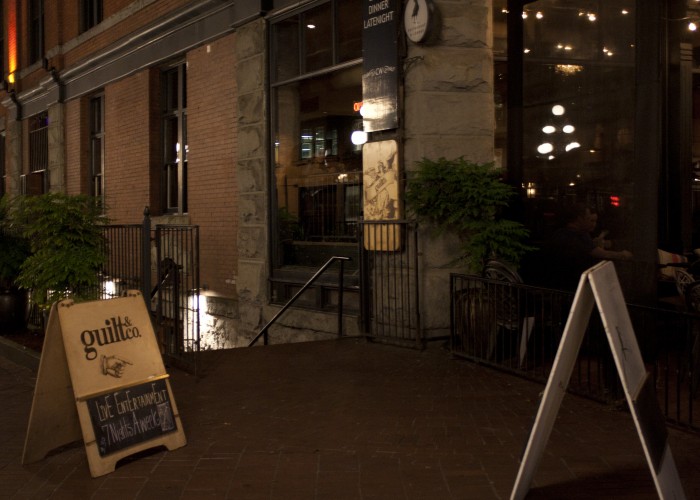
Where is `window`? window is located at coordinates (302, 167), (183, 161), (99, 157), (36, 146), (27, 34), (91, 8), (575, 110).